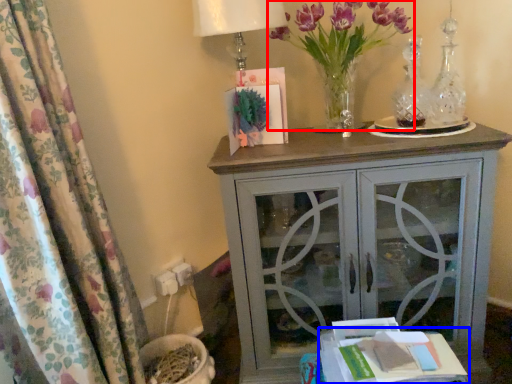
Question: Which of the following is the closest to the observer, floral arrangement (highlighted by a red box) or table (highlighted by a blue box)?

Choices:
 (A) floral arrangement
 (B) table

Answer: (B)